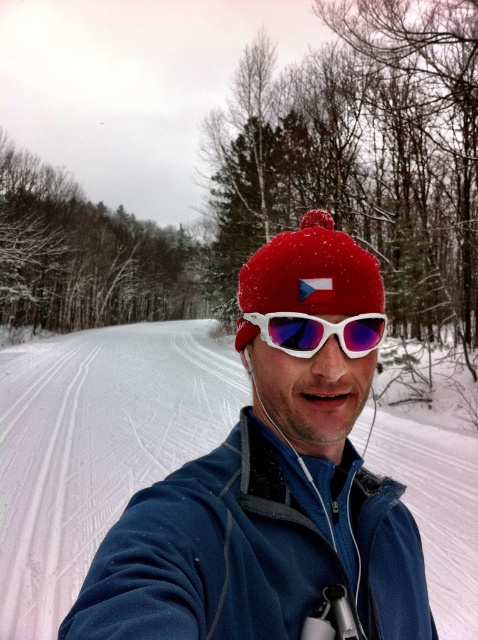
You are standing at point (248,282) and want to walk to the end of the trail. Is the point (395,588) behind you or in front of you relative to your direction of travel?

The point (395,588) is behind point (248,282), so if you are facing the direction of the trail, the point (395,588) would be behind you, meaning it is not in front of you towards the trail end.